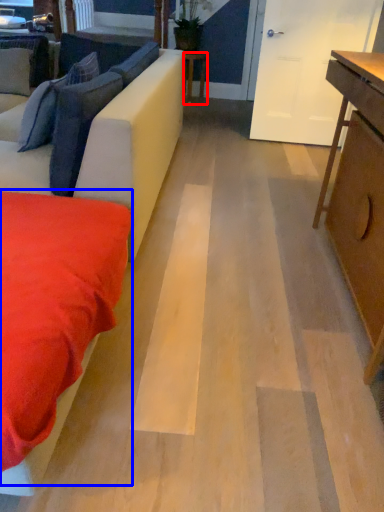
Question: Among these objects, which one is farthest to the camera, table (highlighted by a red box) or bedding (highlighted by a blue box)?

Choices:
 (A) table
 (B) bedding

Answer: (A)